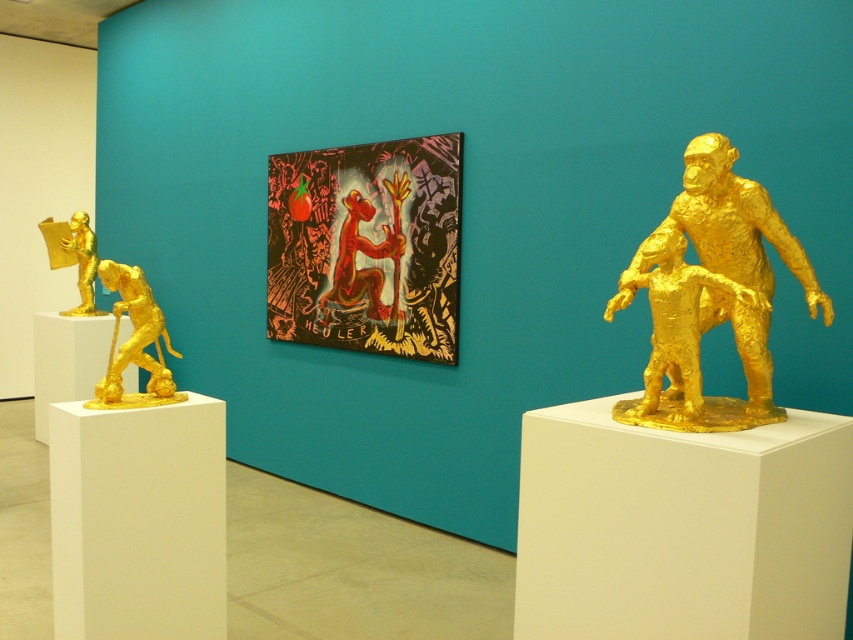
Does gold textured sculpture at right appear over gold metallic figure at right?

Yes.

Who is lower down, gold textured sculpture at right or gold metallic figure at right?

gold metallic figure at right is lower down.

Does point (697, 168) lie in front of point (689, 348)?

That is False.

The height and width of the screenshot is (640, 853). Identify the location of gold textured sculpture at right. (711, 291).

Between shiny red tomato at center and gold metallic figure at right, which one appears on the left side from the viewer's perspective?

From the viewer's perspective, shiny red tomato at center appears more on the left side.

Is shiny red tomato at center to the right of gold metallic figure at right from the viewer's perspective?

No, shiny red tomato at center is not to the right of gold metallic figure at right.

Where is `shiny red tomato at center`? The image size is (853, 640). shiny red tomato at center is located at coordinates (367, 246).

The height and width of the screenshot is (640, 853). What do you see at coordinates (134, 340) in the screenshot? I see `gold shiny dog at left` at bounding box center [134, 340].

Between gold shiny dog at left and metallic red figure at center, which one has less height?

gold shiny dog at left

The width and height of the screenshot is (853, 640). What do you see at coordinates (134, 340) in the screenshot? I see `gold shiny dog at left` at bounding box center [134, 340].

Locate an element on the screen. This screenshot has height=640, width=853. gold shiny dog at left is located at coordinates click(134, 340).